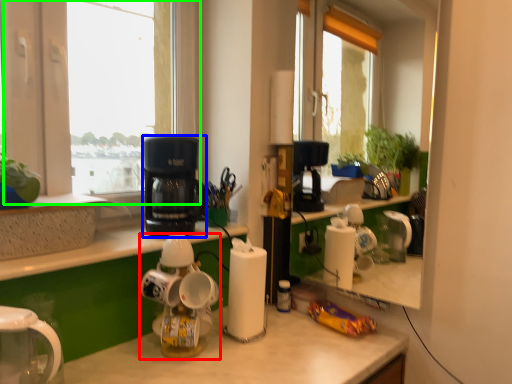
Question: Based on their relative distances, which object is farther from kitchen appliance (highlighted by a red box)? Choose from kitchen appliance (highlighted by a blue box) and window (highlighted by a green box).

Choices:
 (A) kitchen appliance
 (B) window

Answer: (B)